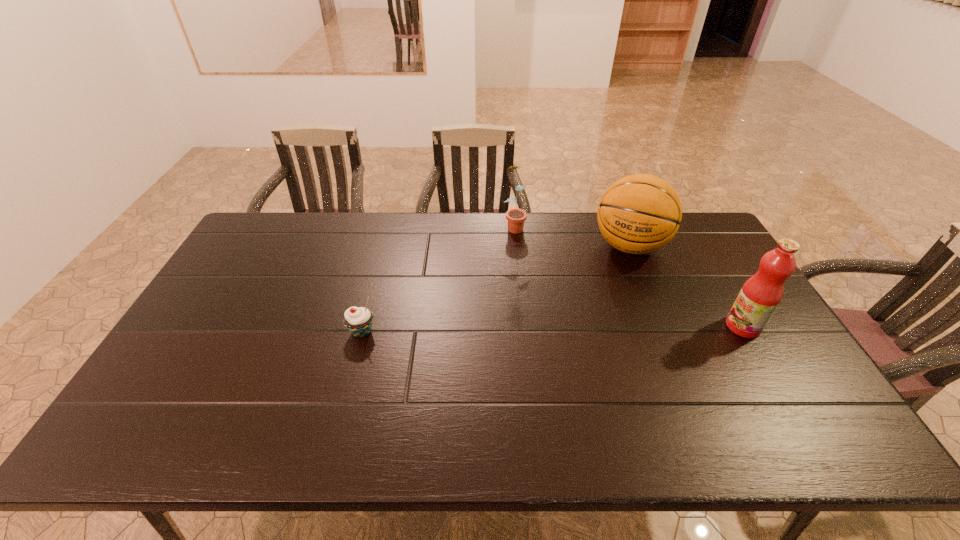
Find the location of `cupcake`. cupcake is located at coordinates (358, 320).

Locate an element on the screen. Image resolution: width=960 pixels, height=540 pixels. the shortest object is located at coordinates (358, 320).

Find the location of a particular element. fruit juice is located at coordinates coord(760,295).

Where is `sunflower`? Image resolution: width=960 pixels, height=540 pixels. sunflower is located at coordinates (516, 217).

The width and height of the screenshot is (960, 540). In order to click on the third object from left to right in this screenshot , I will do `click(638, 214)`.

At what (x,y) coordinates should I click in order to perform the action: click on free space located on the right of the shortest object. Please return your answer as a coordinate pair (x, y). The height and width of the screenshot is (540, 960). Looking at the image, I should click on (466, 332).

The height and width of the screenshot is (540, 960). In order to click on free spot located on the front label of the rightmost object in this screenshot , I will do `click(666, 326)`.

Where is `vacant space located on the front label of the rightmost object`? The height and width of the screenshot is (540, 960). vacant space located on the front label of the rightmost object is located at coordinates (681, 326).

Find the location of `free spot located on the front label of the rightmost object`. free spot located on the front label of the rightmost object is located at coordinates (635, 326).

This screenshot has width=960, height=540. Find the location of `vacant position located on the flower of the sunflower`. vacant position located on the flower of the sunflower is located at coordinates (530, 264).